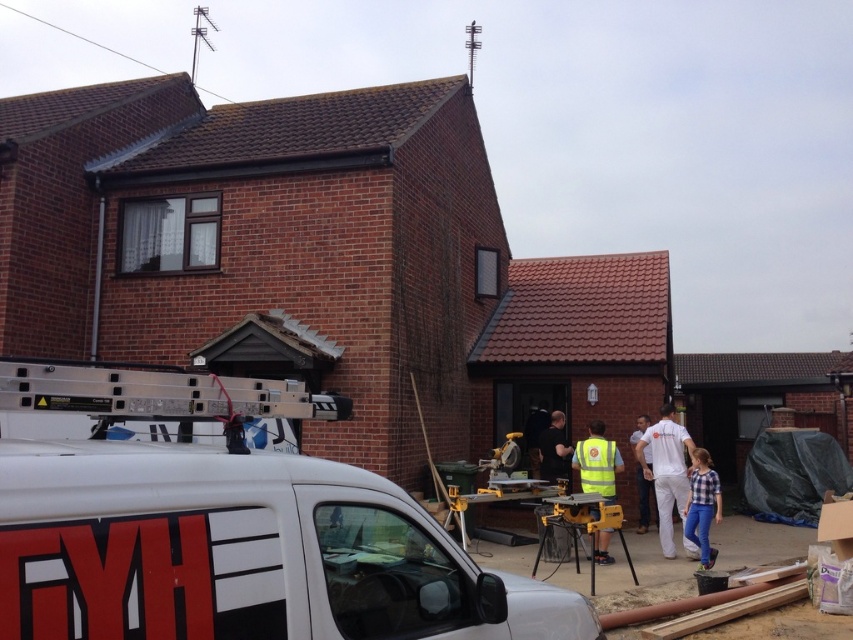
Question: Considering the real-world distances, which object is farthest from the white cotton shirt at center?

Choices:
 (A) reflective yellow vest at center
 (B) yellow reflective vest at center
 (C) white matte van at center

Answer: (C)

Question: Does white matte van at center have a smaller size compared to yellow reflective vest at center?

Choices:
 (A) no
 (B) yes

Answer: (A)

Question: Among these points, which one is nearest to the camera?

Choices:
 (A) (651, 484)
 (B) (670, 536)
 (C) (692, 476)
 (D) (607, 529)

Answer: (D)

Question: Does white matte van at center have a larger size compared to plaid shirt at lower right?

Choices:
 (A) yes
 (B) no

Answer: (A)

Question: Which object is farther from the camera taking this photo?

Choices:
 (A) plaid shirt at lower right
 (B) reflective yellow vest at center

Answer: (B)

Question: Does white matte van at center have a smaller size compared to reflective yellow vest at center?

Choices:
 (A) yes
 (B) no

Answer: (B)